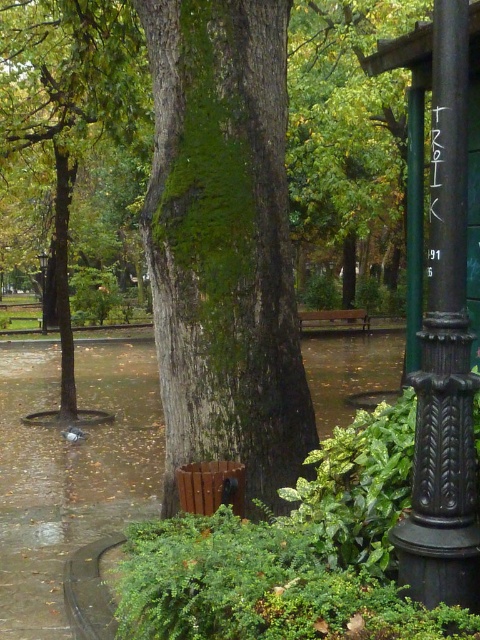
Question: Which of these objects is positioned closest to the brown wooden bench at center?

Choices:
 (A) black cast iron pole at right
 (B) green polished metal pole at right
 (C) metallic pole at center

Answer: (C)

Question: Does green mossy tree trunk at center have a greater width compared to green polished metal pole at right?

Choices:
 (A) no
 (B) yes

Answer: (A)

Question: Does black cast iron pole at right appear on the left side of metallic pole at center?

Choices:
 (A) yes
 (B) no

Answer: (B)

Question: Can you confirm if green mossy tree trunk at center is thinner than brown wooden bench at center?

Choices:
 (A) no
 (B) yes

Answer: (B)

Question: Which is nearer to the green polished metal pole at right?

Choices:
 (A) green mossy tree trunk at center
 (B) black cast iron pole at right

Answer: (A)

Question: Among these points, which one is farthest from the camera?

Choices:
 (A) pos(358,312)
 (B) pos(49,266)
 (C) pos(429,284)
 (D) pos(411,218)

Answer: (B)